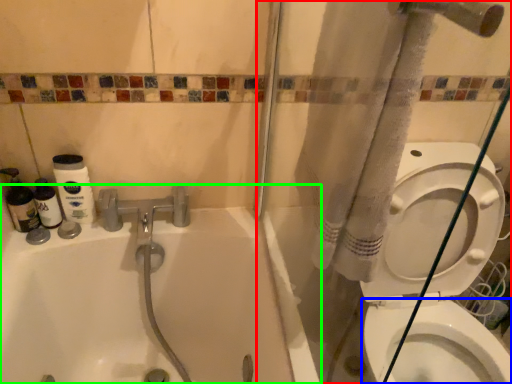
Question: Based on their relative distances, which object is farther from shower door (highlighted by a red box)? Choose from bidet (highlighted by a blue box) and bathtub (highlighted by a green box).

Choices:
 (A) bidet
 (B) bathtub

Answer: (A)